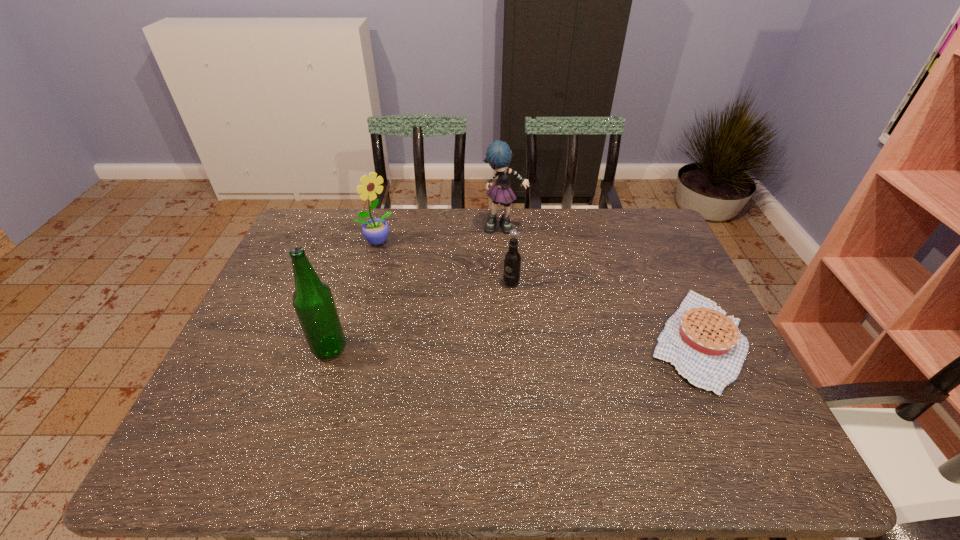
Identify the location of vacant space in between the shortest object and the root beer. The width and height of the screenshot is (960, 540). click(x=604, y=311).

In order to click on object that is the second closest to the shortest object in this screenshot , I will do `click(498, 155)`.

The height and width of the screenshot is (540, 960). Find the location of `object that is the closest to the rightmost object`. object that is the closest to the rightmost object is located at coordinates (512, 260).

Where is `blank space that satisfies the following two spatial constraints: 1. on the front side of the pie; 2. on the right side of the third shortest object`? The image size is (960, 540). blank space that satisfies the following two spatial constraints: 1. on the front side of the pie; 2. on the right side of the third shortest object is located at coordinates (348, 340).